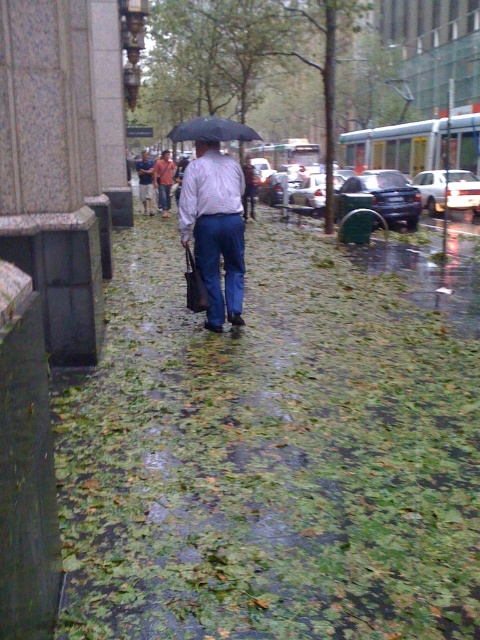
Question: In this image, where is matte white shirt at center located relative to denim pants at center?

Choices:
 (A) right
 (B) left

Answer: (A)

Question: Which point is closer to the camera?

Choices:
 (A) black matte umbrella at center
 (B) green leafy pavement at center
 (C) matte white shirt at center

Answer: (B)

Question: Among these objects, which one is farthest from the camera?

Choices:
 (A) matte white shirt at center
 (B) black matte umbrella at center

Answer: (B)

Question: Is matte white shirt at center to the right of black matte umbrella at center from the viewer's perspective?

Choices:
 (A) yes
 (B) no

Answer: (A)

Question: Which point is closer to the camera taking this photo?

Choices:
 (A) (210, 120)
 (B) (68, 480)
 (C) (142, 196)
 (D) (213, 317)

Answer: (B)

Question: Can you confirm if green leafy pavement at center is thinner than matte white shirt at center?

Choices:
 (A) yes
 (B) no

Answer: (B)